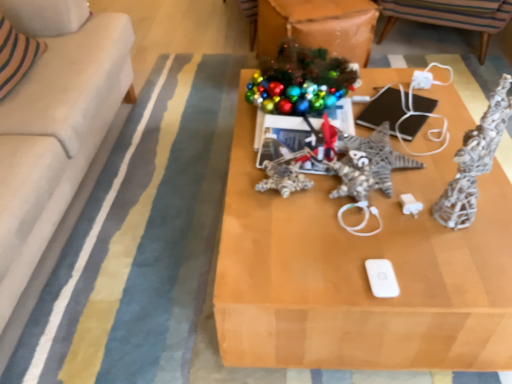
Question: Is white matte ipod at center not near striped fabric chair at upper center?

Choices:
 (A) no
 (B) yes

Answer: (B)

Question: Is white matte ipod at center facing towards striped fabric chair at upper center?

Choices:
 (A) yes
 (B) no

Answer: (B)

Question: Is white matte ipod at center facing away from striped fabric chair at upper center?

Choices:
 (A) no
 (B) yes

Answer: (A)

Question: Is white matte ipod at center touching striped fabric chair at upper center?

Choices:
 (A) yes
 (B) no

Answer: (B)

Question: Considering the relative sizes of white matte ipod at center and striped fabric chair at upper center in the image provided, is white matte ipod at center wider than striped fabric chair at upper center?

Choices:
 (A) no
 (B) yes

Answer: (A)

Question: From a real-world perspective, is white matte ipod at center located beneath striped fabric chair at upper center?

Choices:
 (A) yes
 (B) no

Answer: (B)

Question: Can you confirm if white fabric couch at left is positioned to the left of wooden table at center?

Choices:
 (A) no
 (B) yes

Answer: (B)

Question: Considering the relative positions of white fabric couch at left and wooden table at center in the image provided, is white fabric couch at left to the right of wooden table at center from the viewer's perspective?

Choices:
 (A) no
 (B) yes

Answer: (A)

Question: From a real-world perspective, is white fabric couch at left over wooden table at center?

Choices:
 (A) no
 (B) yes

Answer: (B)

Question: Can you confirm if white fabric couch at left is taller than wooden table at center?

Choices:
 (A) yes
 (B) no

Answer: (A)

Question: Are white fabric couch at left and wooden table at center beside each other?

Choices:
 (A) no
 (B) yes

Answer: (A)

Question: Does white fabric couch at left have a lesser height compared to wooden table at center?

Choices:
 (A) no
 (B) yes

Answer: (A)

Question: From a real-world perspective, is white matte ipod at center on wooden table at center?

Choices:
 (A) no
 (B) yes

Answer: (B)